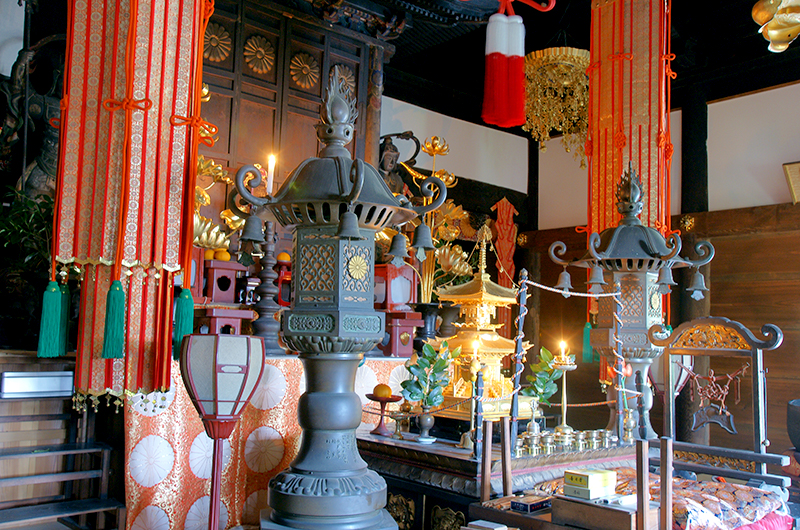
Where is `chandelier`? chandelier is located at coordinates (578, 113).